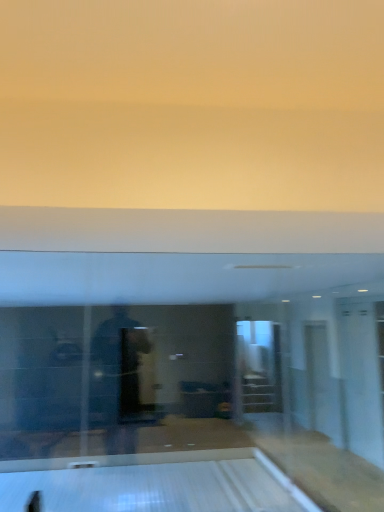
Question: From the image's perspective, is white glossy bowling alley at lower center above or below transparent glass door at right?

Choices:
 (A) below
 (B) above

Answer: (A)

Question: Is white glossy bowling alley at lower center in front of or behind transparent glass door at right in the image?

Choices:
 (A) front
 (B) behind

Answer: (A)

Question: Is white glossy bowling alley at lower center to the left or to the right of transparent glass door at right in the image?

Choices:
 (A) left
 (B) right

Answer: (A)

Question: In the image, is transparent glass door at right positioned in front of or behind white glossy bowling alley at lower center?

Choices:
 (A) front
 (B) behind

Answer: (B)

Question: Which is correct: transparent glass door at right is inside white glossy bowling alley at lower center, or outside of it?

Choices:
 (A) outside
 (B) inside

Answer: (A)

Question: Considering the relative positions of transparent glass door at right and white glossy bowling alley at lower center in the image provided, is transparent glass door at right to the left or to the right of white glossy bowling alley at lower center?

Choices:
 (A) left
 (B) right

Answer: (B)

Question: Is point (354, 408) closer or farther from the camera than point (258, 489)?

Choices:
 (A) closer
 (B) farther

Answer: (B)